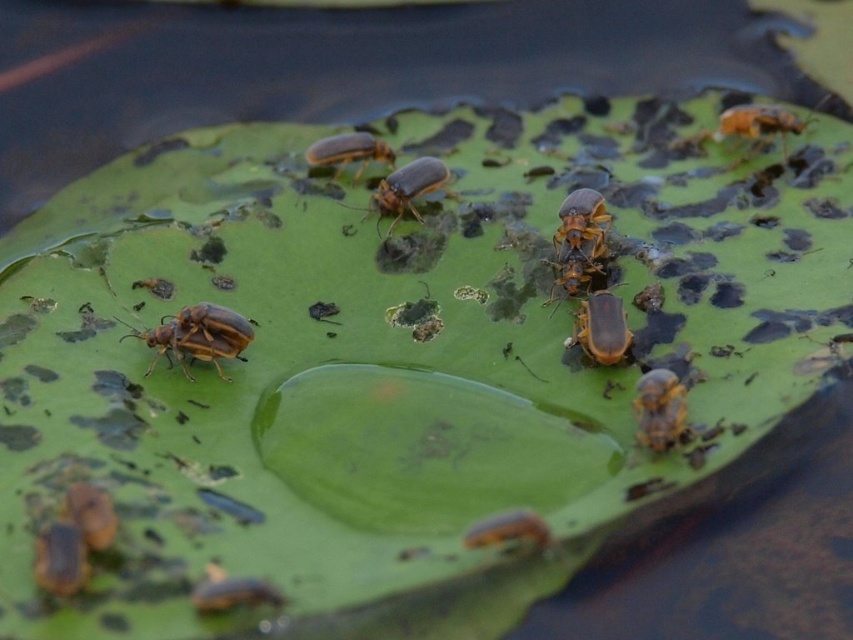
Identify the location of yellow-orange glossy beetle at center. This screenshot has width=853, height=640. (347, 150).

Is matte yellow beetle at center below shiny brown beetle at center?

Incorrect, matte yellow beetle at center is not positioned below shiny brown beetle at center.

Between matte yellow beetle at center and shiny brown beetle at center, which one has more height?

matte yellow beetle at center

Is point (425, 161) positioned after point (561, 276)?

Yes, it is behind point (561, 276).

This screenshot has width=853, height=640. I want to click on matte yellow beetle at center, so click(x=405, y=188).

Can you confirm if matte yellow beetle at center is positioned below yellow matte beetle at center?

No, matte yellow beetle at center is not below yellow matte beetle at center.

Is point (428, 176) closer to viewer compared to point (595, 198)?

No, it is not.

You are a GUI agent. You are given a task and a screenshot of the screen. Output one action in this format:
    pyautogui.click(x=<x>, y=<y>)
    Task: Click on the matte yellow beetle at center
    The height and width of the screenshot is (640, 853).
    Given the screenshot: What is the action you would take?
    pyautogui.click(x=405, y=188)